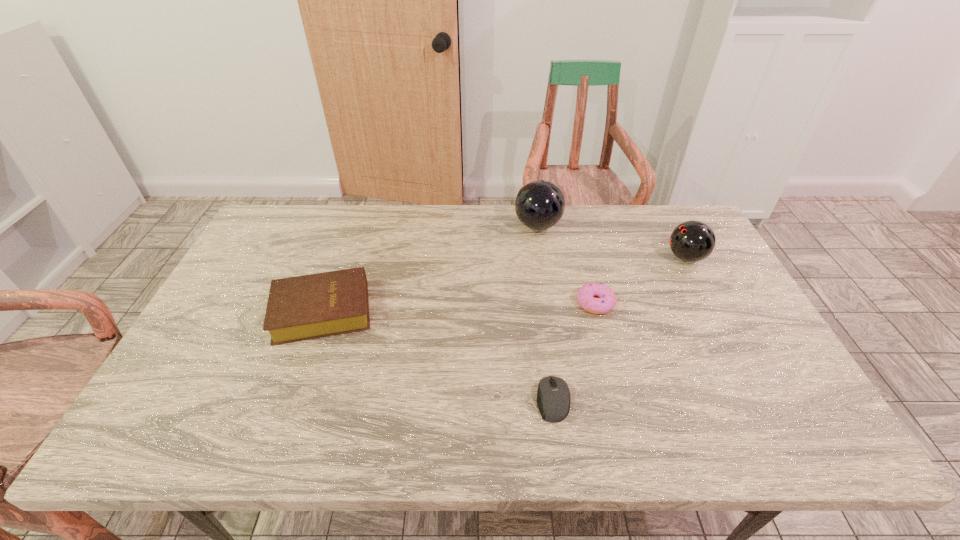
Where is `the farther bowling ball`? This screenshot has height=540, width=960. the farther bowling ball is located at coordinates (539, 205).

Where is `the left bowling ball`? This screenshot has width=960, height=540. the left bowling ball is located at coordinates (539, 205).

At what (x,y) coordinates should I click in order to perform the action: click on the right bowling ball. Please return your answer as a coordinate pair (x, y). Looking at the image, I should click on (691, 241).

Where is `the second tallest object`? This screenshot has width=960, height=540. the second tallest object is located at coordinates (691, 241).

This screenshot has height=540, width=960. Identify the location of the third shortest object. [x=312, y=306].

This screenshot has height=540, width=960. Identify the location of Bible. (312, 306).

Identify the location of the second shortest object. (606, 300).

This screenshot has width=960, height=540. I want to click on the shortest object, so click(553, 396).

Where is `the nearest object`? the nearest object is located at coordinates (553, 396).

The height and width of the screenshot is (540, 960). What are the coordinates of `blank space located on the side of the left bowling ball with the finger holes` in the screenshot? It's located at (479, 226).